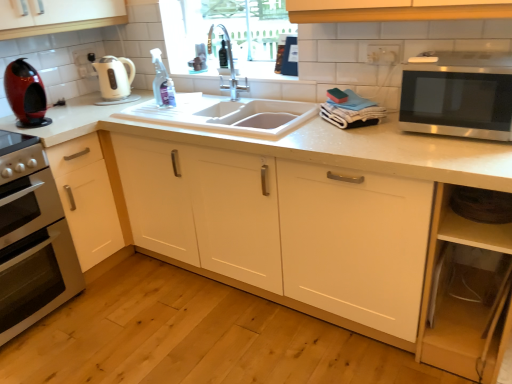
Question: Considering their positions, is white glossy oven at left located in front of or behind white matte cabinet at lower left, positioned as the second cabinetry in right-to-left order?

Choices:
 (A) behind
 (B) front

Answer: (B)

Question: Is white glossy oven at left situated inside white matte cabinet at lower left, which ranks as the first cabinetry in left-to-right order, or outside?

Choices:
 (A) outside
 (B) inside

Answer: (A)

Question: Which is nearer to the white glossy oven at left?

Choices:
 (A) white matte cabinet at center, marked as the 1th cabinetry in a right-to-left arrangement
 (B) silver metallic faucet at center
 (C) white matte cabinet at lower left, positioned as the second cabinetry in right-to-left order
 (D) stainless steel microwave at right
 (E) shiny red coffee machine at left

Answer: (C)

Question: Estimate the real-world distances between objects in this image. Which object is closer to the silver metallic faucet at center?

Choices:
 (A) shiny red coffee machine at left
 (B) stainless steel microwave at right
 (C) white glossy electric kettle at upper left
 (D) white matte cabinet at center, marked as the 1th cabinetry in a right-to-left arrangement
 (E) white glossy oven at left

Answer: (C)